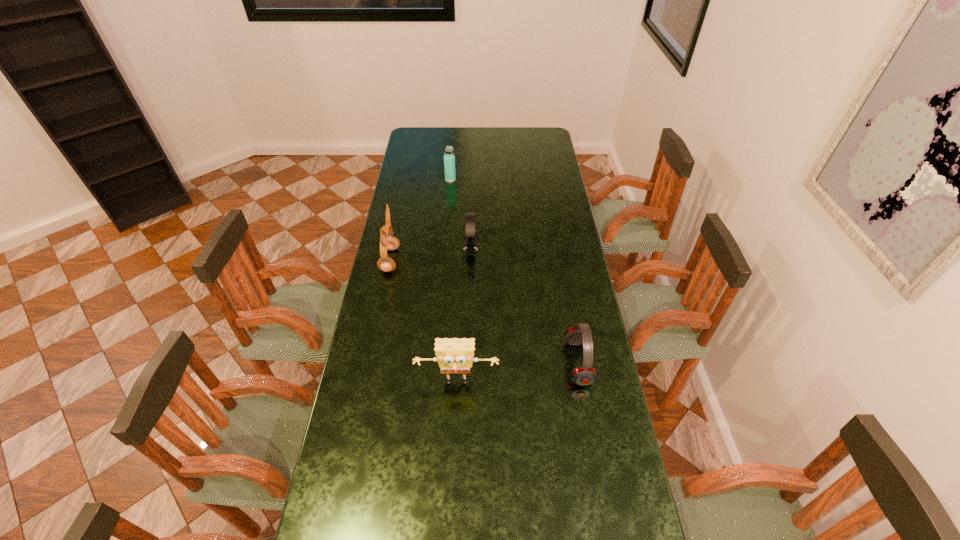
At what (x,y) coordinates should I click in order to perform the action: click on vacant area situated 0.300m on the ear cups of the second earphone from right to left. Please return your answer as a coordinate pair (x, y). The width and height of the screenshot is (960, 540). Looking at the image, I should click on (552, 248).

The image size is (960, 540). In order to click on vacant space located 0.310m on the ear cups of the rightmost object in this screenshot , I will do [471, 362].

Find the location of a particular element. vacant space located on the ear cups of the rightmost object is located at coordinates (474, 362).

This screenshot has height=540, width=960. I want to click on vacant space located on the ear cups of the rightmost object, so click(520, 362).

Identify the location of object at the left edge. The width and height of the screenshot is (960, 540). (387, 241).

The image size is (960, 540). Identify the location of object that is at the right edge. (584, 375).

The width and height of the screenshot is (960, 540). What are the coordinates of `free space at the far edge of the desktop` in the screenshot? It's located at (501, 133).

The height and width of the screenshot is (540, 960). I want to click on vacant position at the left edge of the desktop, so click(392, 428).

This screenshot has width=960, height=540. In the image, there is a desktop. In order to click on vacant area at the right edge in this screenshot , I will do pos(535,170).

The height and width of the screenshot is (540, 960). Find the location of `free region at the far right corner of the desktop`. free region at the far right corner of the desktop is located at coordinates (543, 128).